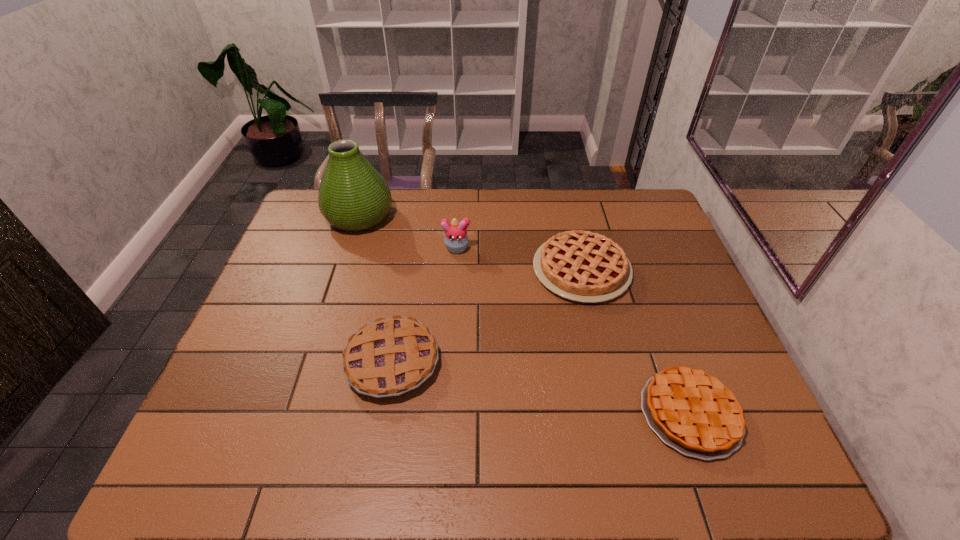
The height and width of the screenshot is (540, 960). What are the coordinates of `object positioned at the far edge` in the screenshot? It's located at click(353, 196).

This screenshot has width=960, height=540. In order to click on object that is at the near edge in this screenshot , I will do `click(691, 411)`.

This screenshot has height=540, width=960. Identify the location of object that is positioned at the left edge. (353, 196).

Find the location of a particular element. The height and width of the screenshot is (540, 960). object situated at the right edge is located at coordinates (691, 411).

Locate an element on the screen. The width and height of the screenshot is (960, 540). object positioned at the far left corner is located at coordinates (353, 196).

Where is `object that is at the near right corner`? The height and width of the screenshot is (540, 960). object that is at the near right corner is located at coordinates 691,411.

In the image, there is a desktop. Identify the location of vacant space at the far edge. coord(494,191).

The height and width of the screenshot is (540, 960). Find the location of `vacant position at the near edge of the desktop`. vacant position at the near edge of the desktop is located at coordinates (552, 478).

Where is `vacant space at the right edge`? The width and height of the screenshot is (960, 540). vacant space at the right edge is located at coordinates (662, 313).

At what (x,y) coordinates should I click in order to perform the action: click on free location at the near right corner of the desktop. Please return your answer as a coordinate pair (x, y). Image resolution: width=960 pixels, height=540 pixels. Looking at the image, I should click on (725, 476).